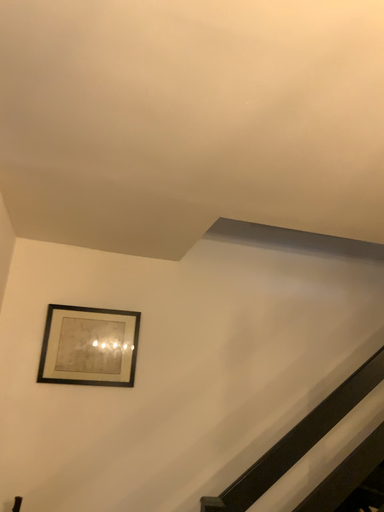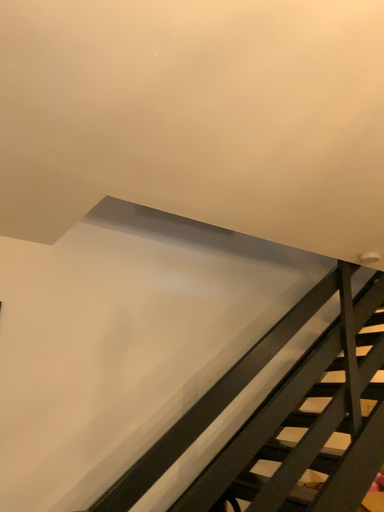
Question: How did the camera likely rotate when shooting the video?

Choices:
 (A) rotated right
 (B) rotated left

Answer: (A)